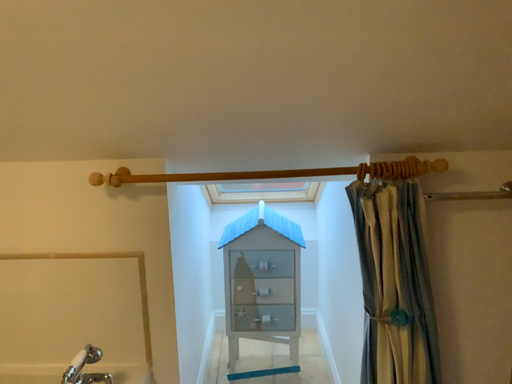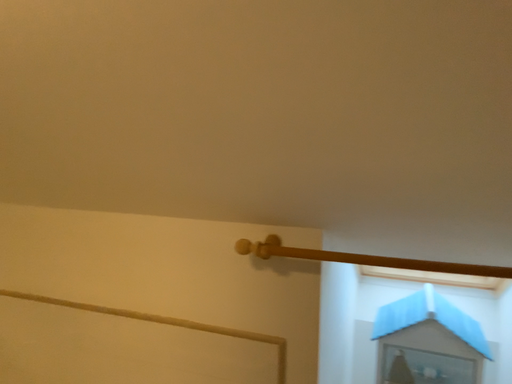
Question: How did the camera likely rotate when shooting the video?

Choices:
 (A) rotated left
 (B) rotated right

Answer: (A)